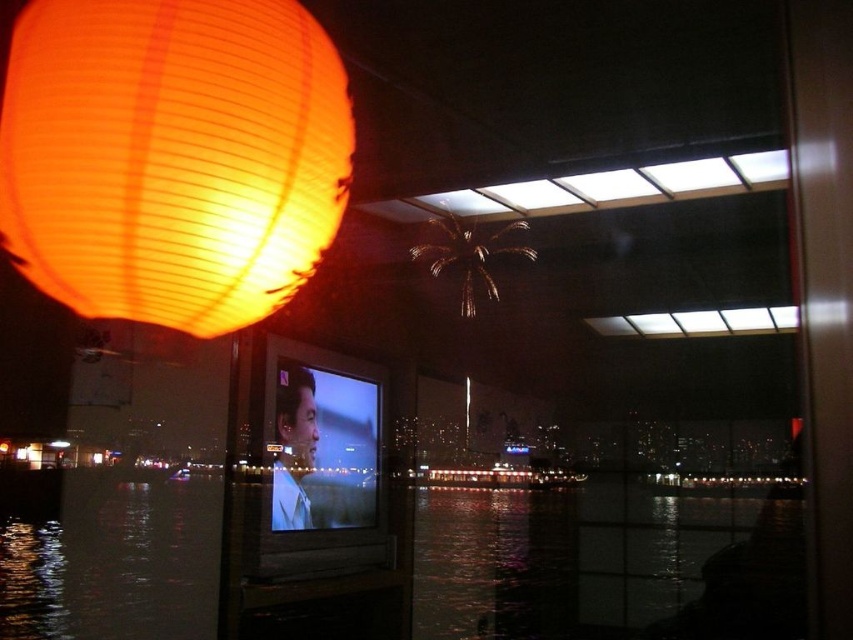
This screenshot has width=853, height=640. I want to click on matte paper lantern at upper left, so click(172, 156).

Is matte paper lantern at upper left above metallic gold palm tree at upper center?

No.

Locate an element on the screen. matte paper lantern at upper left is located at coordinates (172, 156).

Which is more to the right, transparent glass water at center or matte paper lantern at upper left?

transparent glass water at center

Between point (10, 532) and point (233, 49), which one is positioned in front?

Point (233, 49) is more forward.

Does point (566, 500) come farther from viewer compared to point (54, 228)?

Yes, point (566, 500) is behind point (54, 228).

I want to click on transparent glass water at center, so click(x=392, y=563).

In the scene shown: Is transparent glass water at center bigger than metallic gold palm tree at upper center?

Yes.

Can you confirm if transparent glass water at center is positioned above metallic gold palm tree at upper center?

No, transparent glass water at center is not above metallic gold palm tree at upper center.

Is point (325, 627) positioned behind point (465, 298)?

That is True.

What are the coordinates of `transparent glass water at center` in the screenshot? It's located at (x=392, y=563).